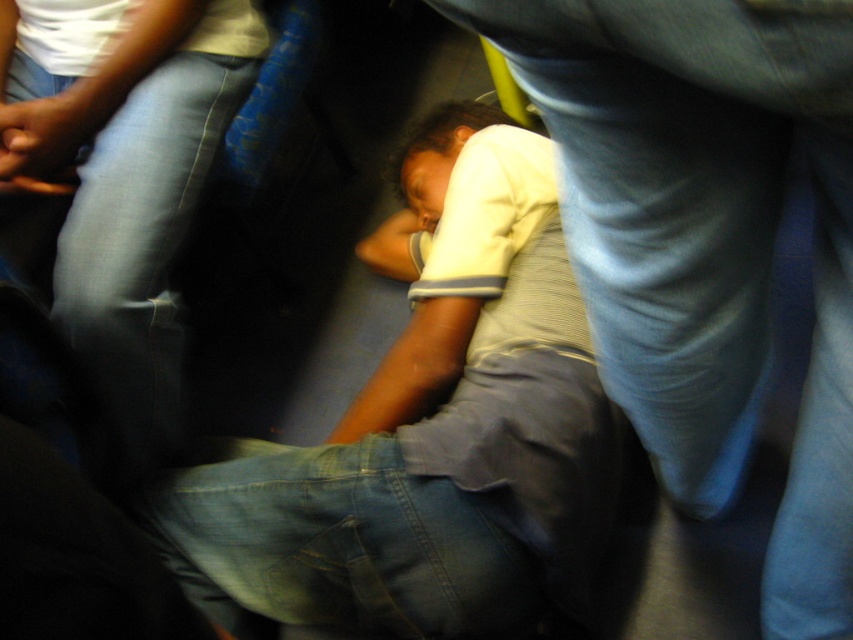
You are a photographer trying to capture a candid shot of the two shirts mentioned. Since the white cotton shirt at center is wider than the gray striped shirt at center, which shirt might you focus on to ensure both shirts are fully visible in the frame without cropping?

The white cotton shirt at center is wider than the gray striped shirt at center, so focusing on the white cotton shirt at center would ensure both shirts are fully visible in the frame without cropping.

You are a photographer trying to capture a candid shot of the white cotton shirt at center and the gray striped shirt at center in this crowded transit scene. Since the image is slightly blurred due to motion, which shirt should you focus on to ensure a clearer photo?

The white cotton shirt at center is located above the gray striped shirt at center, so focusing on the white cotton shirt at center would be better as it is closer to the camera, reducing motion blur.

You are a passenger on a crowded bus and need to reach your destination. You see a point marked at coordinates (431, 432). What object is located at that point?

The point marked at coordinates (431, 432) corresponds to the white cotton shirt at center.